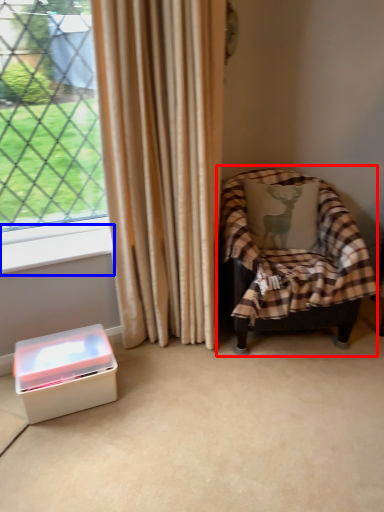
Question: Which object appears farthest to the camera in this image, chair (highlighted by a red box) or window sill (highlighted by a blue box)?

Choices:
 (A) chair
 (B) window sill

Answer: (B)